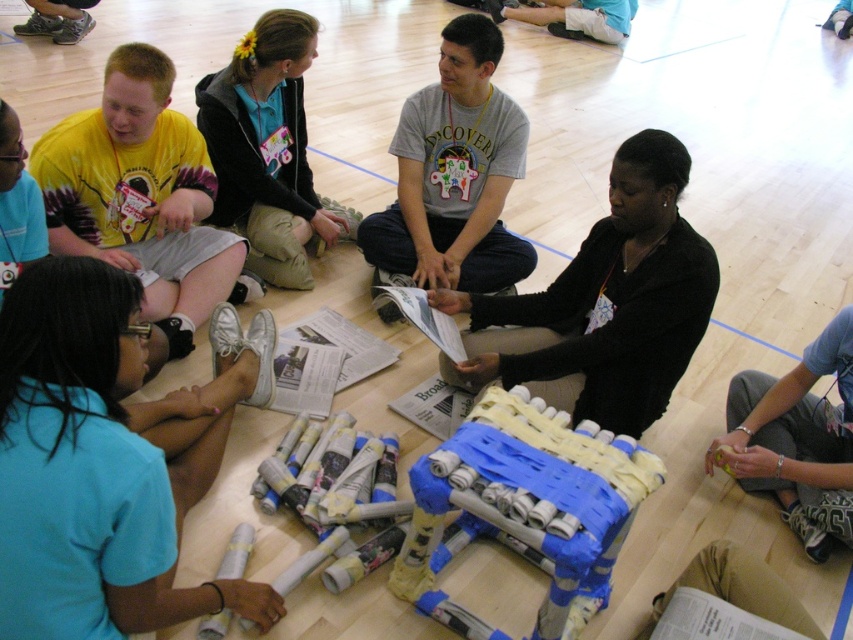
Question: Which object is closer to the camera taking this photo?

Choices:
 (A) black hoodie at center
 (B) blue fabric pants at lower right

Answer: (B)

Question: Observing the image, what is the correct spatial positioning of black hoodie at center in reference to blue fabric pants at lower right?

Choices:
 (A) below
 (B) above

Answer: (B)

Question: Does black hoodie at center have a smaller size compared to blue fabric pants at lower right?

Choices:
 (A) no
 (B) yes

Answer: (A)

Question: Can you confirm if black hoodie at center is positioned above blue fabric pants at lower right?

Choices:
 (A) yes
 (B) no

Answer: (A)